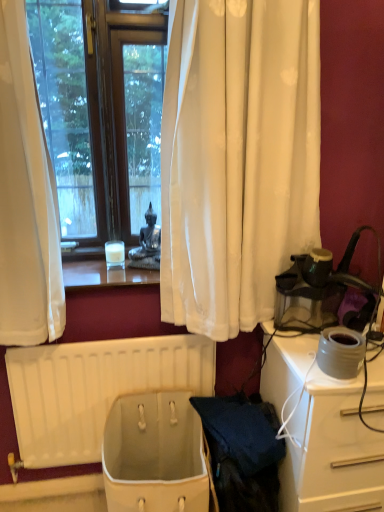
Question: Does white plastic radiator at lower center appear on the left side of white fabric basket at lower center?

Choices:
 (A) yes
 (B) no

Answer: (A)

Question: Is white plastic radiator at lower center further to camera compared to white fabric basket at lower center?

Choices:
 (A) yes
 (B) no

Answer: (A)

Question: Is white plastic radiator at lower center oriented towards white fabric basket at lower center?

Choices:
 (A) yes
 (B) no

Answer: (A)

Question: Considering the relative sizes of white plastic radiator at lower center and white fabric basket at lower center in the image provided, is white plastic radiator at lower center shorter than white fabric basket at lower center?

Choices:
 (A) yes
 (B) no

Answer: (B)

Question: Considering the relative sizes of white plastic radiator at lower center and white fabric basket at lower center in the image provided, is white plastic radiator at lower center taller than white fabric basket at lower center?

Choices:
 (A) yes
 (B) no

Answer: (A)

Question: From a real-world perspective, is white plastic radiator at lower center over white fabric basket at lower center?

Choices:
 (A) yes
 (B) no

Answer: (A)

Question: Can you see translucent glass candle at center touching white plastic radiator at lower center?

Choices:
 (A) no
 (B) yes

Answer: (A)

Question: Is translucent glass candle at center thinner than white plastic radiator at lower center?

Choices:
 (A) yes
 (B) no

Answer: (B)

Question: Is white plastic radiator at lower center at the back of translucent glass candle at center?

Choices:
 (A) yes
 (B) no

Answer: (B)

Question: Are translucent glass candle at center and white plastic radiator at lower center located far from each other?

Choices:
 (A) yes
 (B) no

Answer: (B)

Question: From the image's perspective, is translucent glass candle at center over white plastic radiator at lower center?

Choices:
 (A) yes
 (B) no

Answer: (A)

Question: Considering the relative sizes of translucent glass candle at center and white plastic radiator at lower center in the image provided, is translucent glass candle at center smaller than white plastic radiator at lower center?

Choices:
 (A) no
 (B) yes

Answer: (B)

Question: Does matte gray pot at right appear on the right side of white glossy desk at right?

Choices:
 (A) no
 (B) yes

Answer: (A)